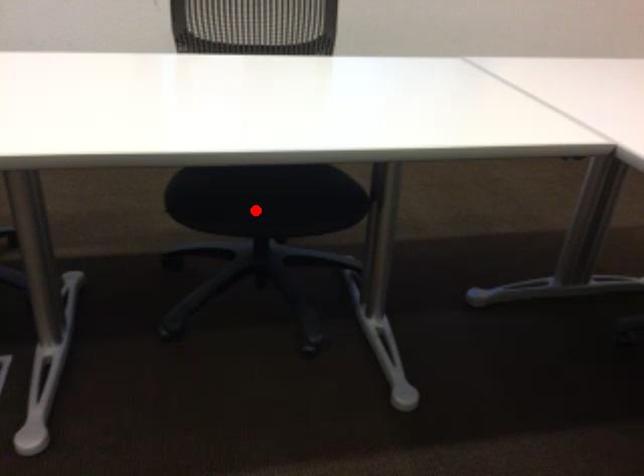
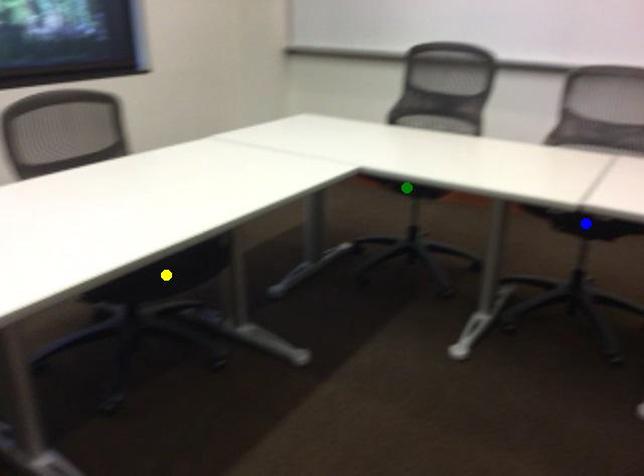
Question: I am providing you with two images of the same scene from different viewpoints. A red point is marked on the first image. You are given multiple points on the second image. Which mark in image 2 goes with the point in image 1?

Choices:
 (A) green point
 (B) blue point
 (C) yellow point

Answer: (C)